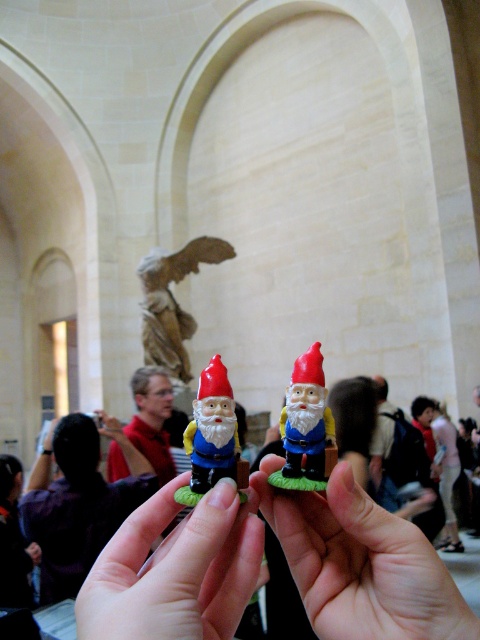
You are a delivery robot in a museum. You need to place a package on a stable surface. The scene shows a point at coordinates (360, 563). Is this point on a surface that can support the package?

The point (360, 563) is on smooth plastic hand at center, which is not a stable surface for placing a package. Look for a solid surface like a table or shelf instead.

Consider the image. You are a delivery robot that needs to place a package between the smooth plastic hand at center and the plastic gnome at center. The package is 20 inches long. Can you fit the package between them?

The distance between the smooth plastic hand at center and the plastic gnome at center is 21.01 inches, so the package which is 20 inches long can fit between them since it is shorter than the available space.

You are an art curator examining the gnomes displayed in the grand building. You notice two garden gnome figurines held by smooth plastic hand at center and smooth plastic hands at center. Which of the two hands is bigger?

The smooth plastic hand at center is larger in size than the smooth plastic hands at center.